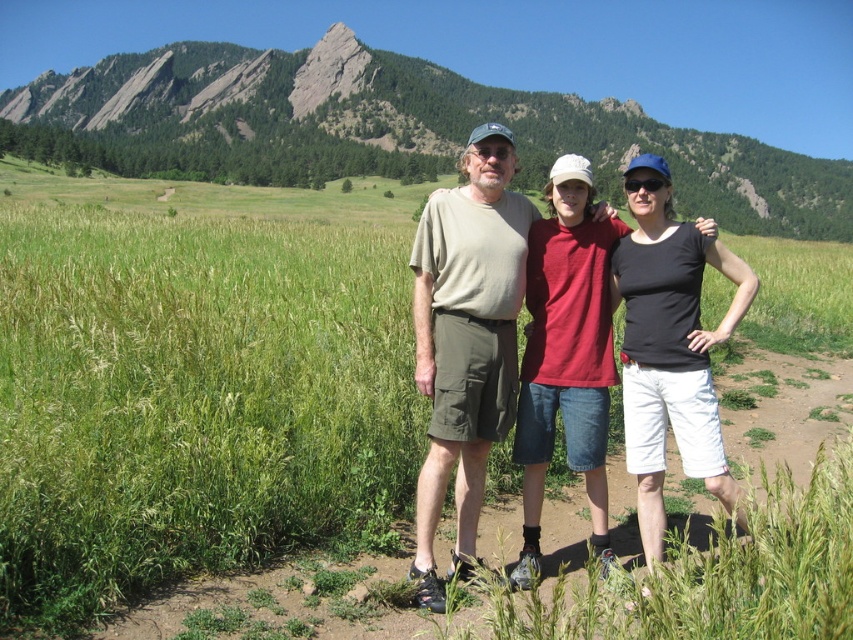
Question: Among these objects, which one is nearest to the camera?

Choices:
 (A) black cotton t-shirt at center
 (B) matte khaki shorts at center
 (C) green grassy field at upper center

Answer: (B)

Question: Considering the relative positions of khaki cotton shorts at center and matte black tank top at center in the image provided, where is khaki cotton shorts at center located with respect to matte black tank top at center?

Choices:
 (A) left
 (B) right

Answer: (A)

Question: Is green grassy field at upper center above matte khaki shorts at center?

Choices:
 (A) no
 (B) yes

Answer: (B)

Question: Which of the following is the closest to the observer?

Choices:
 (A) (532, 324)
 (B) (421, 305)
 (C) (634, 388)
 (D) (84, 77)

Answer: (C)

Question: Observing the image, what is the correct spatial positioning of khaki cotton shorts at center in reference to matte black tank top at center?

Choices:
 (A) left
 (B) right

Answer: (A)

Question: Which object appears farthest from the camera in this image?

Choices:
 (A) matte black tank top at center
 (B) black cotton t-shirt at center

Answer: (B)